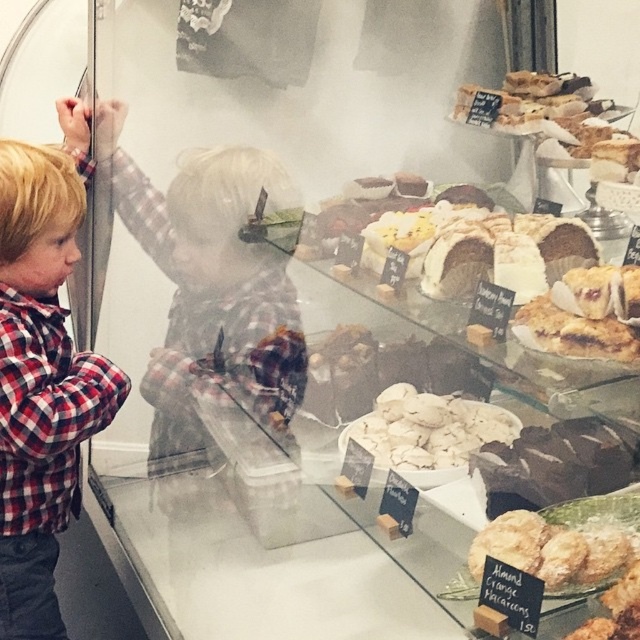
Question: Does golden flaky pie at center lie in front of almond croissant at lower right?

Choices:
 (A) no
 (B) yes

Answer: (B)

Question: Which point is farther to the camera?

Choices:
 (A) white fluffy pastries at center
 (B) golden flaky pie at center

Answer: (A)

Question: Considering the real-world distances, which object is closest to the almond croissant at lower right?

Choices:
 (A) white fluffy pastries at center
 (B) plaid shirt at left

Answer: (A)

Question: Does plaid shirt at left appear on the left side of white fluffy pastries at center?

Choices:
 (A) yes
 (B) no

Answer: (A)

Question: Which point is closer to the camera taking this photo?

Choices:
 (A) (618, 337)
 (B) (557, 548)
 (C) (65, 499)
 (D) (374, 444)

Answer: (A)

Question: Is plaid shirt at left closer to camera compared to golden flaky pie at center?

Choices:
 (A) yes
 (B) no

Answer: (B)